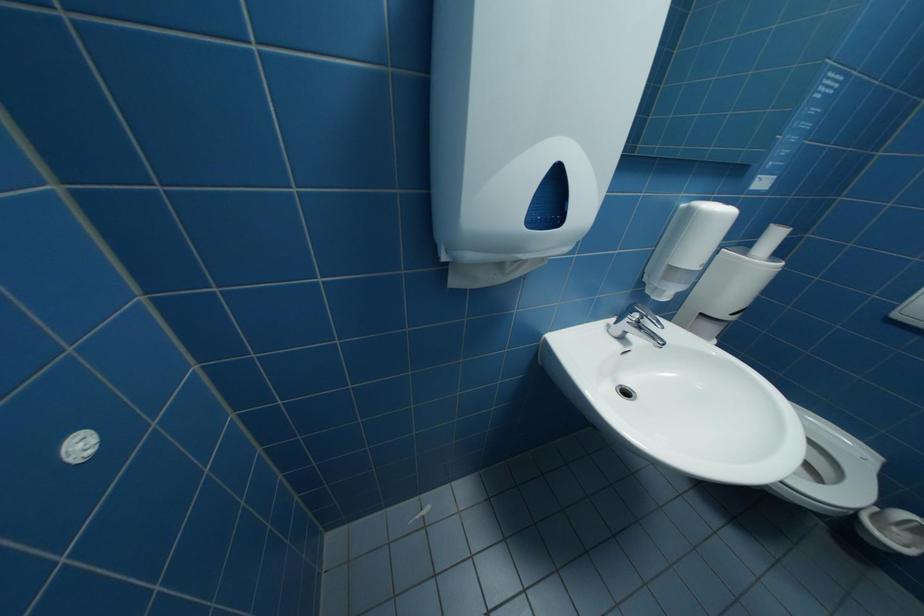
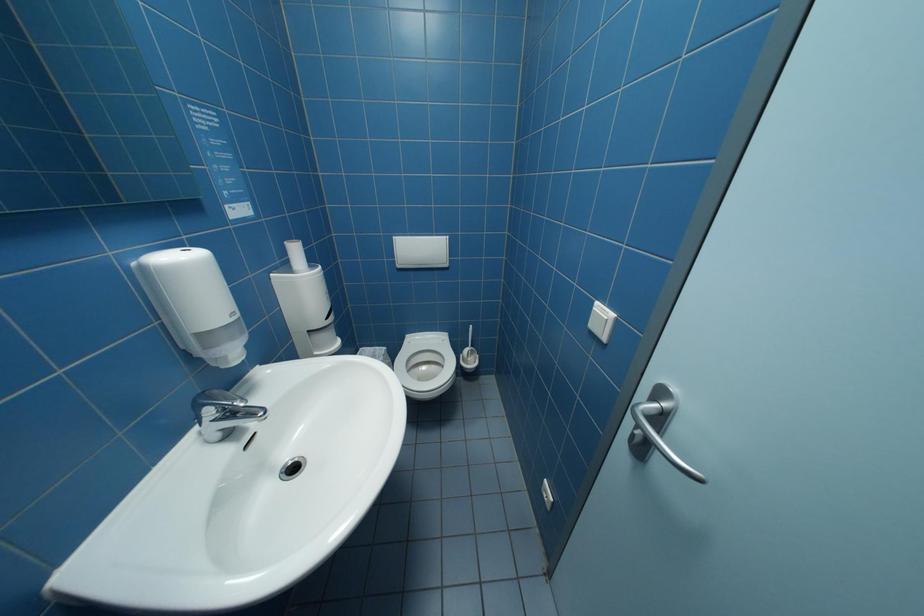
First-person continuous shooting, in which direction is the camera rotating?

The rotation direction of the camera is right-down.